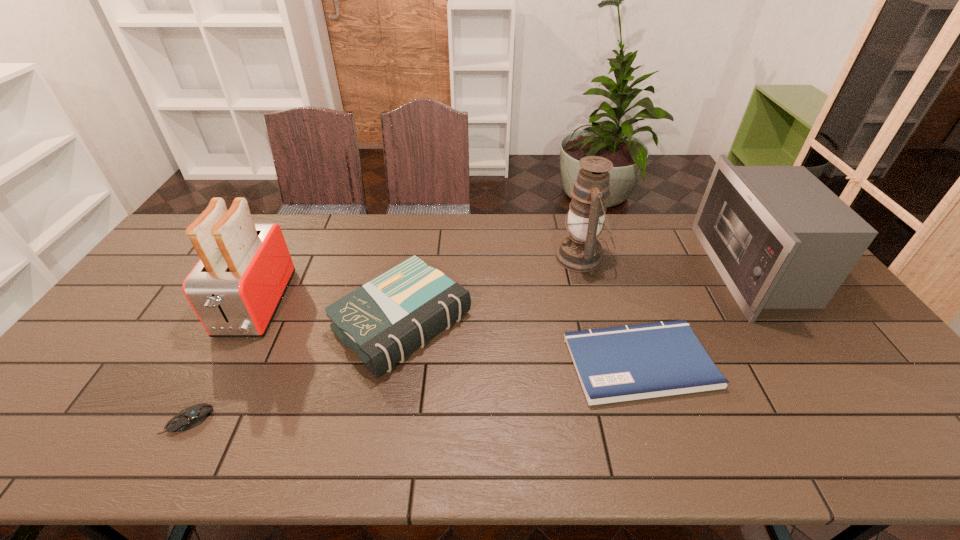
At what (x,y) coordinates should I click in order to perform the action: click on oil lamp. Please return your answer as a coordinate pair (x, y). Looking at the image, I should click on (579, 251).

The height and width of the screenshot is (540, 960). Find the location of `toaster`. toaster is located at coordinates (235, 288).

Where is `microwave oven`? microwave oven is located at coordinates (780, 239).

Find the location of a particular element. the fourth object from right to left is located at coordinates (383, 321).

In order to click on the left paperback book in this screenshot , I will do `click(383, 321)`.

The image size is (960, 540). I want to click on the shorter paperback book, so click(616, 364).

This screenshot has width=960, height=540. What are the coordinates of `computer mouse` in the screenshot? It's located at (190, 417).

Where is `free space located on the left of the oil lamp`? The image size is (960, 540). free space located on the left of the oil lamp is located at coordinates (498, 258).

Find the location of a particular element. Image resolution: width=960 pixels, height=540 pixels. free space located 0.230m on the front-facing side of the toaster is located at coordinates (192, 425).

This screenshot has height=540, width=960. In order to click on vacant space located 0.210m on the front-facing side of the rightmost object in this screenshot , I will do `click(649, 269)`.